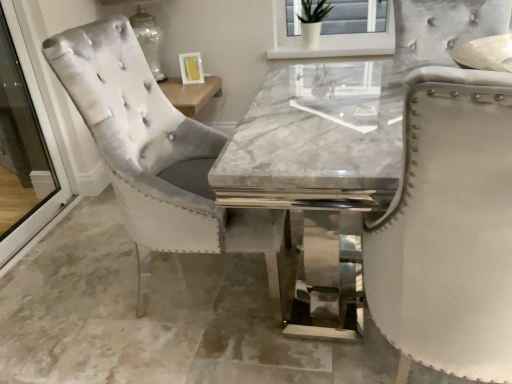
Image resolution: width=512 pixels, height=384 pixels. Find the location of `clear glass screen door at left`. clear glass screen door at left is located at coordinates (24, 147).

In order to face clear glass screen door at left, should I rotate leftwards or rightwards?

Turn left approximately 30.348 degrees to face it.

The image size is (512, 384). What do you see at coordinates (24, 147) in the screenshot? I see `clear glass screen door at left` at bounding box center [24, 147].

What is the approximate width of clear glass screen door at left?

2.42 inches.

The image size is (512, 384). Describe the element at coordinates (158, 317) in the screenshot. I see `velvet chair at left` at that location.

Find the location of a particular element. The width and height of the screenshot is (512, 384). velvet chair at left is located at coordinates (158, 317).

The width and height of the screenshot is (512, 384). I want to click on clear glass screen door at left, so click(x=24, y=147).

Between clear glass screen door at left and velvet chair at left, which one appears on the right side from the viewer's perspective?

velvet chair at left.

Considering the positions of objects clear glass screen door at left and velvet chair at left in the image provided, who is in front, clear glass screen door at left or velvet chair at left?

velvet chair at left is more forward.

Which is closer, (15, 114) or (262, 342)?

Point (15, 114) is positioned farther from the camera compared to point (262, 342).

From the image's perspective, who appears lower, clear glass screen door at left or velvet chair at left?

velvet chair at left.

From a real-world perspective, does clear glass screen door at left stand above velvet chair at left?

Yes.

Is clear glass screen door at left wider than velvet chair at left?

In fact, clear glass screen door at left might be narrower than velvet chair at left.

Does clear glass screen door at left have a lesser height compared to velvet chair at left?

In fact, clear glass screen door at left may be taller than velvet chair at left.

Considering the sizes of objects clear glass screen door at left and velvet chair at left in the image provided, who is bigger, clear glass screen door at left or velvet chair at left?

Bigger between the two is velvet chair at left.

Is velvet chair at left a part of clear glass screen door at left?

No, velvet chair at left is not inside clear glass screen door at left.

Are clear glass screen door at left and velvet chair at left beside each other?

They are not placed beside each other.

Is clear glass screen door at left looking in the opposite direction of velvet chair at left?

No, velvet chair at left is not at the back of clear glass screen door at left.

Can you tell me how much clear glass screen door at left and velvet chair at left differ in facing direction?

clear glass screen door at left and velvet chair at left are facing 0.0845 degrees away from each other.

How much distance is there between clear glass screen door at left and velvet chair at left?

The distance of clear glass screen door at left from velvet chair at left is 75.77 centimeters.

In order to click on screen door on the left side of velvet chair at left in this screenshot , I will do `click(24, 147)`.

Which is more to the right, velvet chair at left or clear glass screen door at left?

Positioned to the right is velvet chair at left.

Is velvet chair at left further to camera compared to clear glass screen door at left?

No, the depth of velvet chair at left is less than that of clear glass screen door at left.

Which is farther, (199, 340) or (39, 142)?

The point (39, 142) is more distant.

From the image's perspective, is velvet chair at left under clear glass screen door at left?

Yes.

Based on the photo, from a real-world perspective, which is physically below, velvet chair at left or clear glass screen door at left?

In real-world perspective, velvet chair at left is lower.

Considering the sizes of objects velvet chair at left and clear glass screen door at left in the image provided, who is thinner, velvet chair at left or clear glass screen door at left?

clear glass screen door at left is thinner.

Between velvet chair at left and clear glass screen door at left, which one has more height?

clear glass screen door at left is taller.

Between velvet chair at left and clear glass screen door at left, which one has larger size?

Bigger between the two is velvet chair at left.

Is velvet chair at left located outside clear glass screen door at left?

That's correct, velvet chair at left is outside of clear glass screen door at left.

Can you see velvet chair at left touching clear glass screen door at left?

velvet chair at left is not next to clear glass screen door at left, and they're not touching.

In the scene shown: Is velvet chair at left oriented towards clear glass screen door at left?

No, velvet chair at left is not oriented towards clear glass screen door at left.

Can you tell me how much velvet chair at left and clear glass screen door at left differ in facing direction?

They differ by 0.0845 degrees in their facing directions.

The height and width of the screenshot is (384, 512). In the image, there is a clear glass screen door at left. In order to click on concrete below it (from the image's perspective) in this screenshot , I will do `click(158, 317)`.

Identify the location of concrete below the clear glass screen door at left (from the image's perspective). This screenshot has height=384, width=512. [158, 317].

Identify the location of screen door above the velvet chair at left (from a real-world perspective). (24, 147).